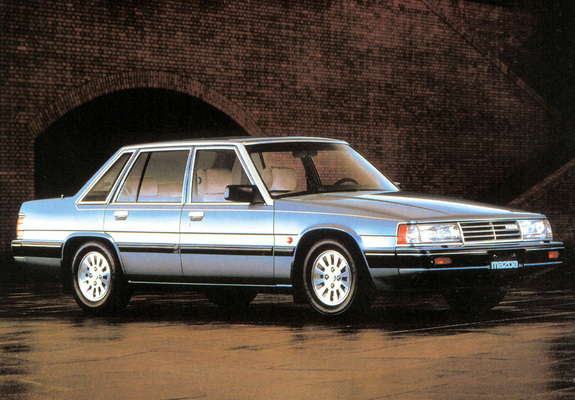
The height and width of the screenshot is (400, 575). Find the location of `headrest`. headrest is located at coordinates (212, 184), (282, 178), (147, 183).